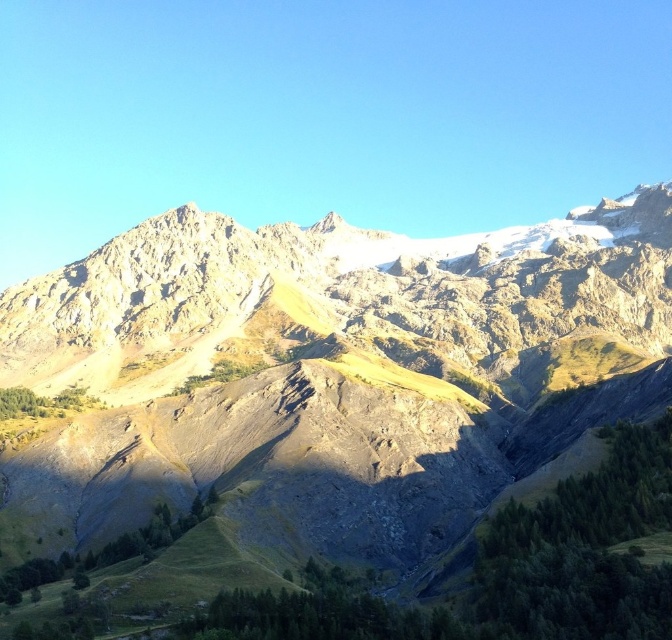
Can you confirm if rugged stone mountain at center is positioned below rugged stone mountain range at upper center?

Yes.

Is rugged stone mountain at center bigger than rugged stone mountain range at upper center?

Yes.

Who is more forward, (228,448) or (581,310)?

Point (228,448)

Identify the location of rugged stone mountain at center. Image resolution: width=672 pixels, height=640 pixels. (329, 378).